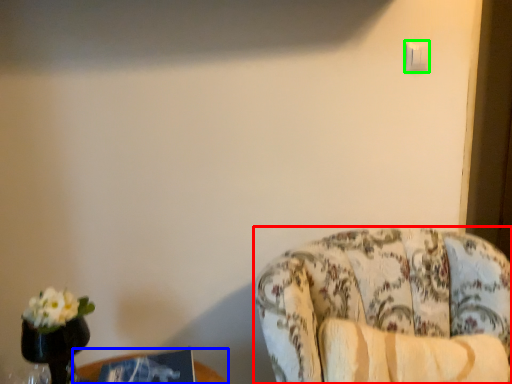
Question: Which object is the closest to the chair (highlighted by a red box)? Choose among these: table (highlighted by a blue box) or light switch (highlighted by a green box).

Choices:
 (A) table
 (B) light switch

Answer: (A)